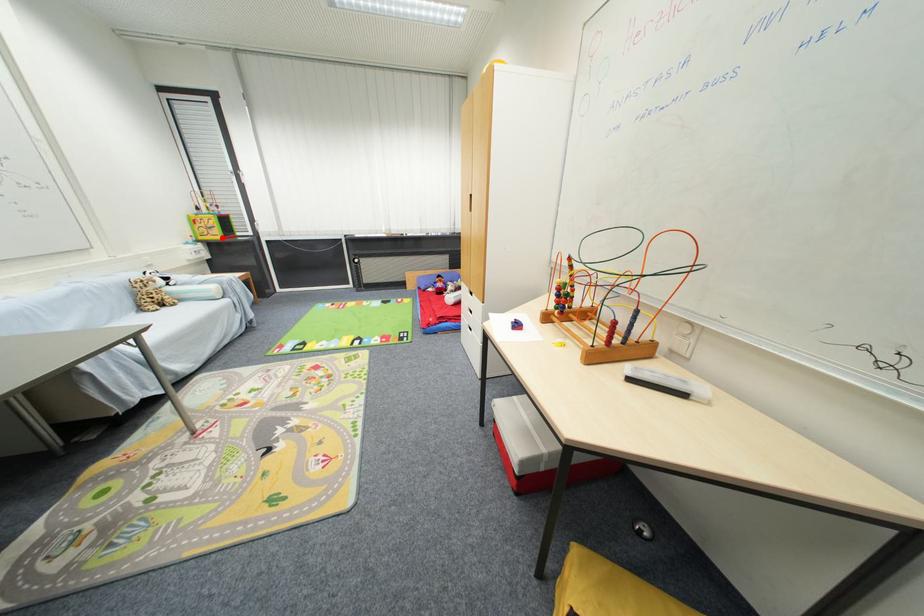
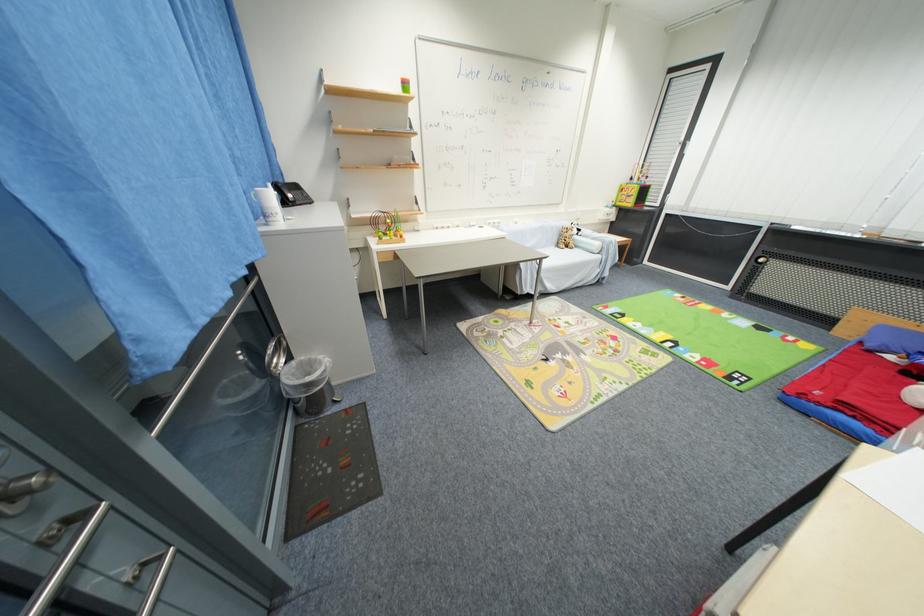
Find the pixel in the second image that matches the highlighted location in the first image.

(635, 206)